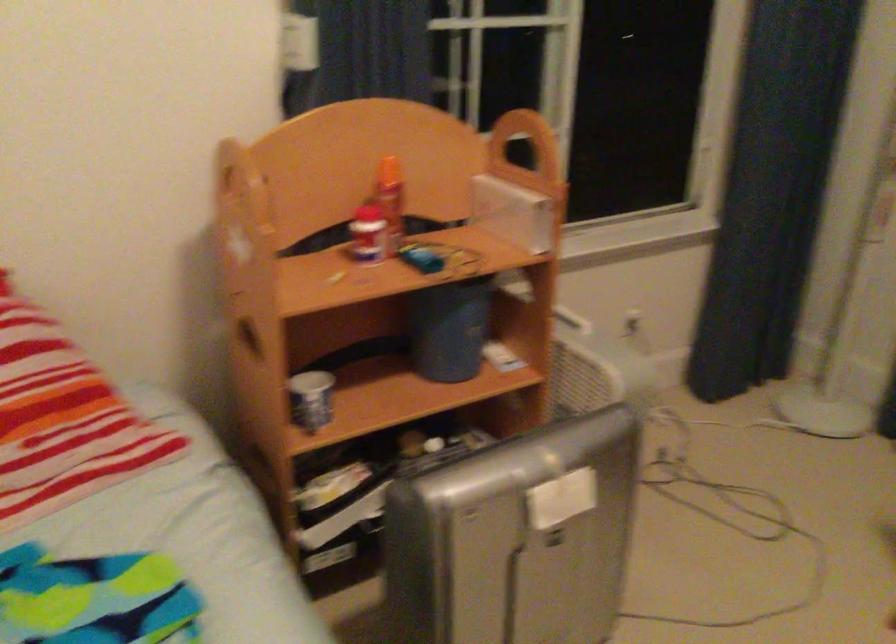
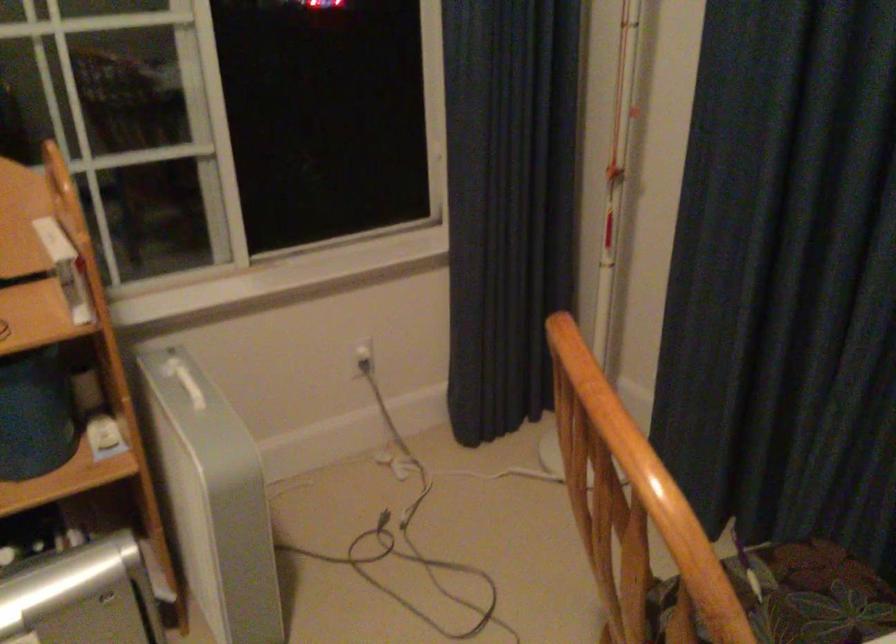
Question: How did the camera likely rotate?

Choices:
 (A) Left
 (B) Right
 (C) Up
 (D) Down

Answer: (B)